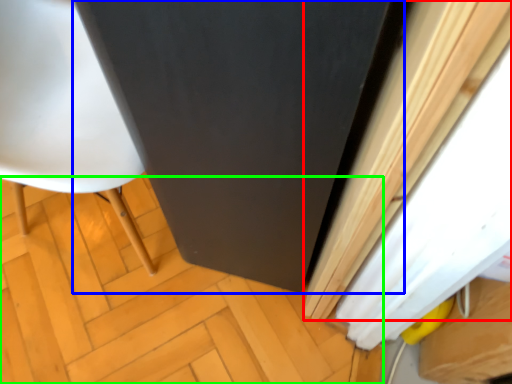
Question: Considering the real-world distances, which object is farthest from curtain (highlighted by a red box)? screen door (highlighted by a blue box) or plywood (highlighted by a green box)?

Choices:
 (A) screen door
 (B) plywood

Answer: (B)